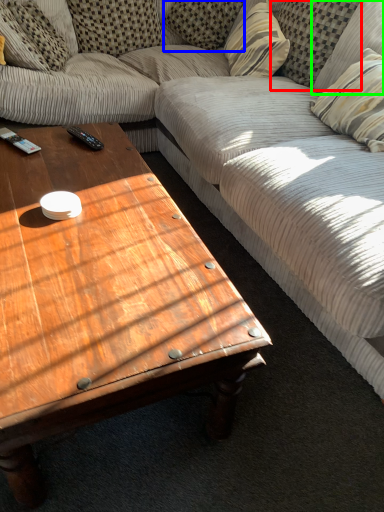
Question: Based on their relative distances, which object is nearer to pillow (highlighted by a red box)? Choose from pillow (highlighted by a blue box) and pillow (highlighted by a green box).

Choices:
 (A) pillow
 (B) pillow

Answer: (B)